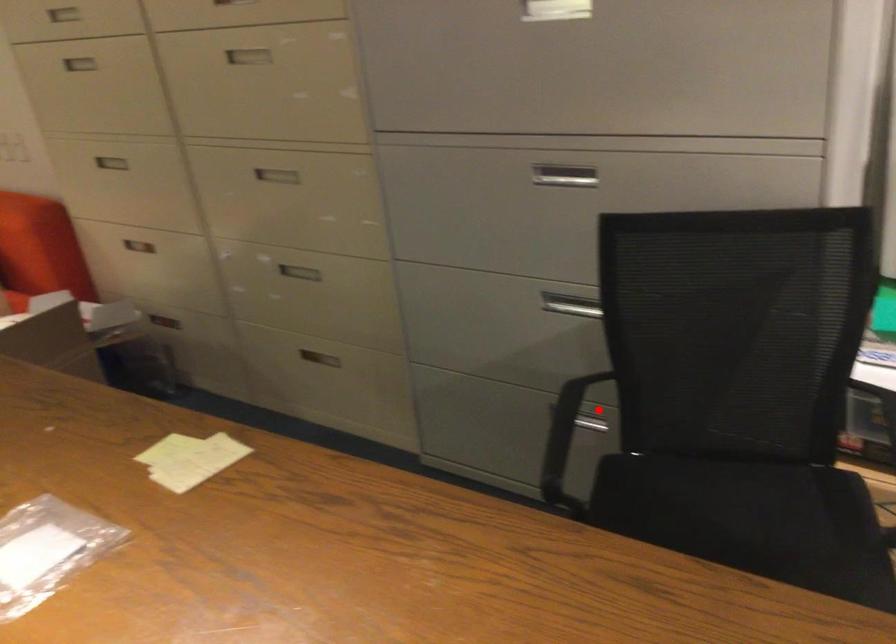
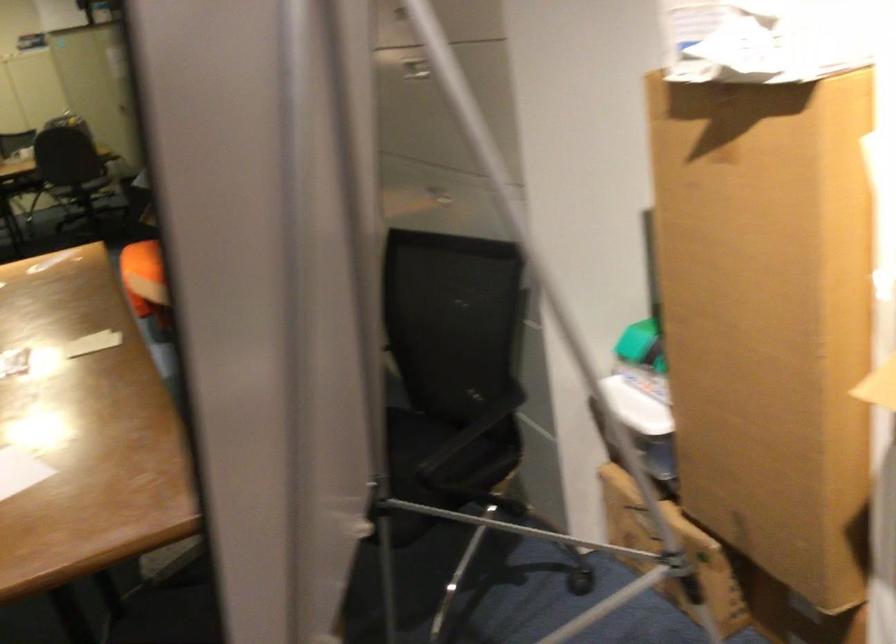
Question: I am providing you with two images of the same scene from different viewpoints. A red point is marked on the first image. Can you still see the location of the red point in image 2?

Choices:
 (A) Yes
 (B) No

Answer: (B)